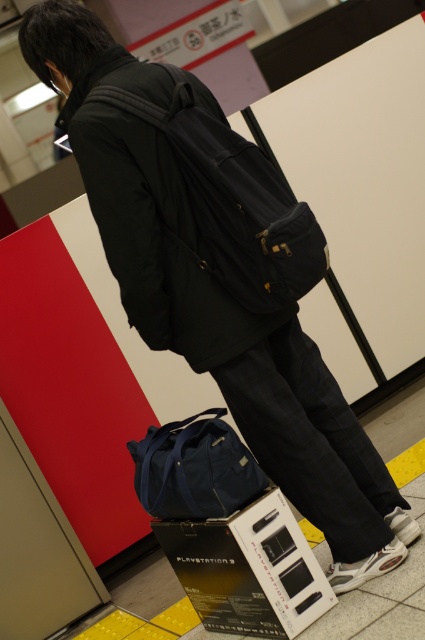
Question: Among these objects, which one is farthest from the camera?

Choices:
 (A) black fabric backpack at center
 (B) matte blue duffel bag at lower center

Answer: (B)

Question: Which object appears farthest from the camera in this image?

Choices:
 (A) matte blue duffel bag at lower center
 (B) black fabric backpack at center

Answer: (A)

Question: Is black fabric backpack at center to the right of matte blue duffel bag at lower center from the viewer's perspective?

Choices:
 (A) yes
 (B) no

Answer: (A)

Question: Does black fabric backpack at center appear under matte blue duffel bag at lower center?

Choices:
 (A) no
 (B) yes

Answer: (A)

Question: Can you confirm if black fabric backpack at center is thinner than matte blue duffel bag at lower center?

Choices:
 (A) no
 (B) yes

Answer: (A)